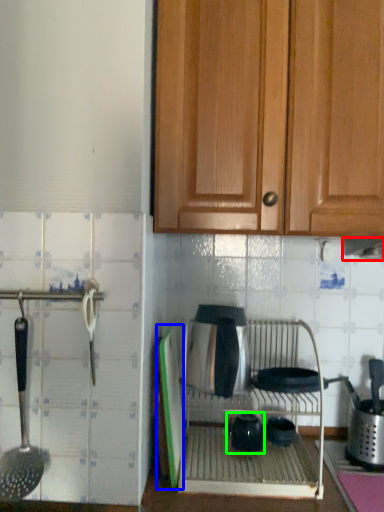
Question: Which object is the closest to the exhaust hood (highlighted by a red box)? Choose among these: screen door (highlighted by a blue box) or tea pot (highlighted by a green box).

Choices:
 (A) screen door
 (B) tea pot

Answer: (B)